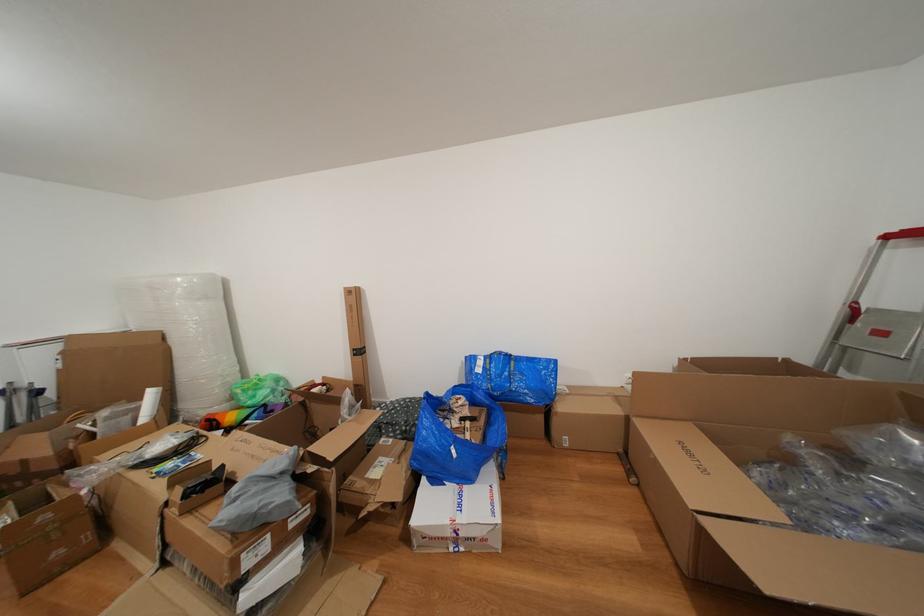
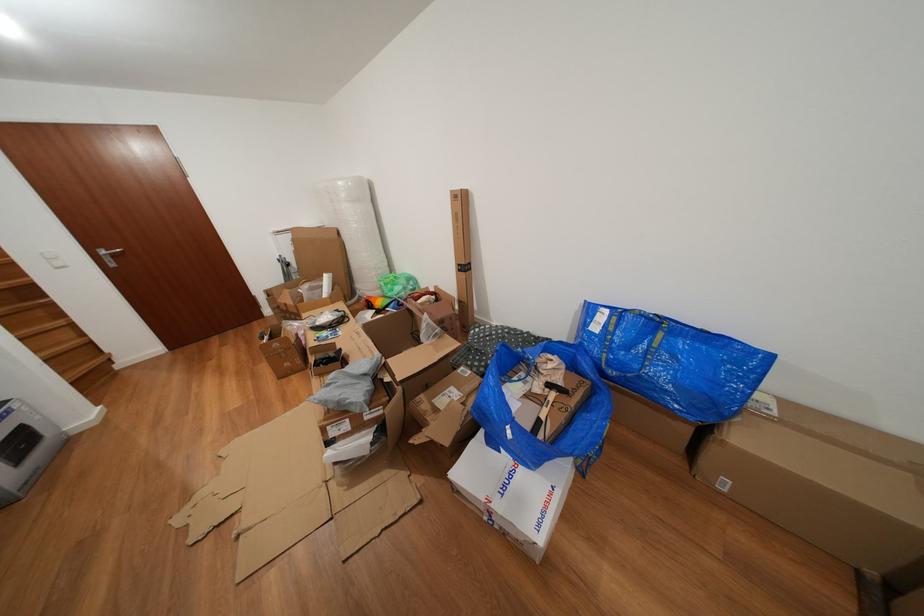
Where in the second image is the point corresponding to (263,419) from the first image?

(399, 310)